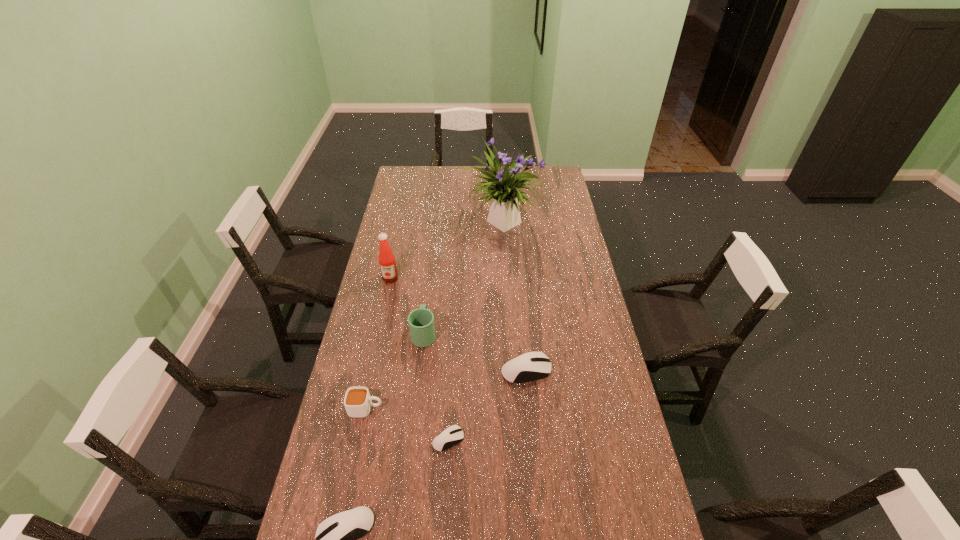
The width and height of the screenshot is (960, 540). What are the coordinates of `vacant area that lies between the sixth nearest object and the fourth farthest object` in the screenshot? It's located at (458, 325).

Identify the location of unoccupied position between the third nearest object and the fourth farthest object. The image size is (960, 540). (446, 389).

At what (x,y) coordinates should I click in order to perform the action: click on object that can be found as the sixth closest to the flower arrangement. Please return your answer as a coordinate pair (x, y). Looking at the image, I should click on (333, 539).

Select which object is the fifth closest to the second mouse from left to right. Please provide its 2D coordinates. Your answer should be formatted as a tuple, i.e. [(x, y)], where the tuple contains the x and y coordinates of a point satisfying the conditions above.

[(388, 268)]

Point out which mouse is positioned as the third nearest to the fourth tallest object. Please provide its 2D coordinates. Your answer should be formatted as a tuple, i.e. [(x, y)], where the tuple contains the x and y coordinates of a point satisfying the conditions above.

[(534, 365)]

Identify which mouse is the nearest to the fifth farthest object. Please provide its 2D coordinates. Your answer should be formatted as a tuple, i.e. [(x, y)], where the tuple contains the x and y coordinates of a point satisfying the conditions above.

[(452, 435)]

The height and width of the screenshot is (540, 960). Find the location of `vacant space that satisfies the following two spatial constraints: 1. on the side with the handle of the third nearest object; 2. on the right side of the shortest mouse`. vacant space that satisfies the following two spatial constraints: 1. on the side with the handle of the third nearest object; 2. on the right side of the shortest mouse is located at coordinates (360, 440).

Identify the location of vacant space that satisfies the following two spatial constraints: 1. on the back side of the second mouse from left to right; 2. on the right side of the farthest mouse. (452, 370).